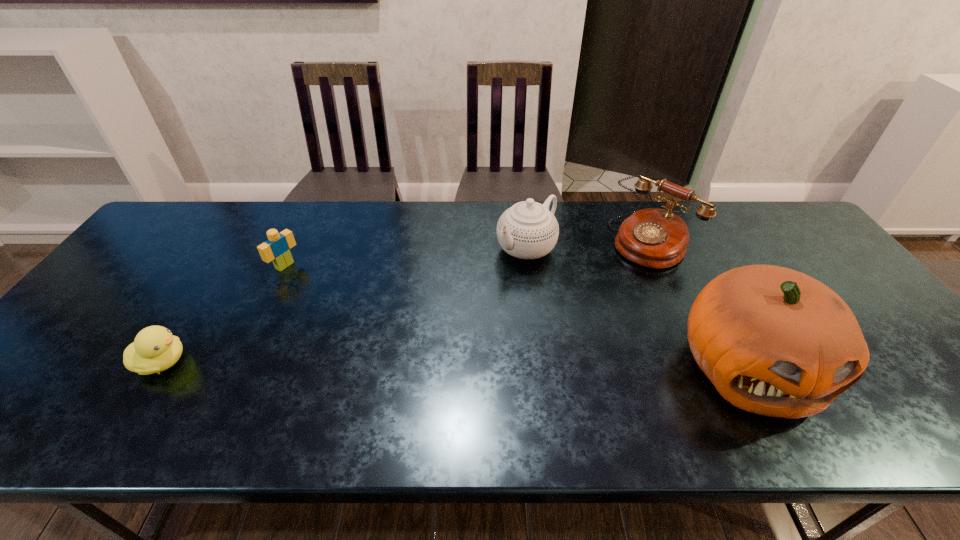
This screenshot has height=540, width=960. Find the location of `vacant space located 0.180m on the face of the second object from left to right`. vacant space located 0.180m on the face of the second object from left to right is located at coordinates (337, 296).

In order to click on free region located on the face of the second object from left to right in this screenshot , I will do `click(362, 310)`.

I want to click on free location located on the face of the second object from left to right, so click(x=346, y=301).

At what (x,y) coordinates should I click in order to perform the action: click on vacant space situated on the dial of the telephone. Please return your answer as a coordinate pair (x, y). This screenshot has height=540, width=960. Looking at the image, I should click on (566, 320).

You are a GUI agent. You are given a task and a screenshot of the screen. Output one action in this format:
    pyautogui.click(x=<x>, y=<y>)
    Task: Click on the vacant point located on the dial of the telephone
    
    Given the screenshot: What is the action you would take?
    coord(608,284)

At what (x,y) coordinates should I click in order to perform the action: click on blank space located 0.170m on the dial of the telephone. Please return your answer as a coordinate pair (x, y). Image resolution: width=960 pixels, height=540 pixels. Looking at the image, I should click on (600, 291).

At what (x,y) coordinates should I click in order to perform the action: click on chinaware that is at the far edge. Please return your answer as a coordinate pair (x, y). The image size is (960, 540). Looking at the image, I should click on (528, 230).

Where is `telephone at the far edge`? telephone at the far edge is located at coordinates [x=656, y=238].

Locate an element on the screen. The width and height of the screenshot is (960, 540). duckling present at the near edge is located at coordinates (155, 349).

You are a GUI agent. You are given a task and a screenshot of the screen. Output one action in this format:
    pyautogui.click(x=<x>, y=<y>)
    Task: Click on the pumpkin that is positioned at the near edge
    Image resolution: width=960 pixels, height=540 pixels.
    Given the screenshot: What is the action you would take?
    pyautogui.click(x=776, y=342)